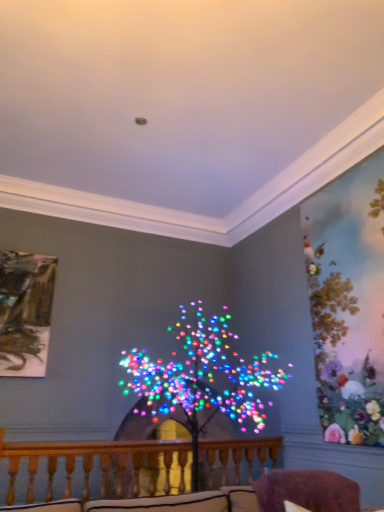
Question: Is purple fuzzy swivel chair at lower right at the back of wooden at center?

Choices:
 (A) yes
 (B) no

Answer: (A)

Question: Can you confirm if wooden at center is wider than purple fuzzy swivel chair at lower right?

Choices:
 (A) yes
 (B) no

Answer: (B)

Question: Would you say purple fuzzy swivel chair at lower right is part of wooden at center's contents?

Choices:
 (A) yes
 (B) no

Answer: (B)

Question: Can you confirm if wooden at center is positioned to the left of purple fuzzy swivel chair at lower right?

Choices:
 (A) no
 (B) yes

Answer: (B)

Question: From a real-world perspective, is wooden at center positioned under purple fuzzy swivel chair at lower right based on gravity?

Choices:
 (A) no
 (B) yes

Answer: (B)

Question: Considering the relative sizes of wooden at center and purple fuzzy swivel chair at lower right in the image provided, is wooden at center smaller than purple fuzzy swivel chair at lower right?

Choices:
 (A) yes
 (B) no

Answer: (B)

Question: From a real-world perspective, is purple fuzzy swivel chair at lower right positioned over wooden at center based on gravity?

Choices:
 (A) no
 (B) yes

Answer: (B)

Question: Is purple fuzzy swivel chair at lower right not near wooden at center?

Choices:
 (A) yes
 (B) no

Answer: (A)

Question: Can you confirm if purple fuzzy swivel chair at lower right is shorter than wooden at center?

Choices:
 (A) no
 (B) yes

Answer: (B)

Question: From the image's perspective, is purple fuzzy swivel chair at lower right above wooden at center?

Choices:
 (A) yes
 (B) no

Answer: (A)

Question: Is purple fuzzy swivel chair at lower right surrounding wooden at center?

Choices:
 (A) yes
 (B) no

Answer: (B)

Question: Is the position of purple fuzzy swivel chair at lower right less distant than that of wooden at center?

Choices:
 (A) no
 (B) yes

Answer: (B)

Question: Is purple fuzzy swivel chair at lower right shorter than multicolored lights at center?

Choices:
 (A) yes
 (B) no

Answer: (A)